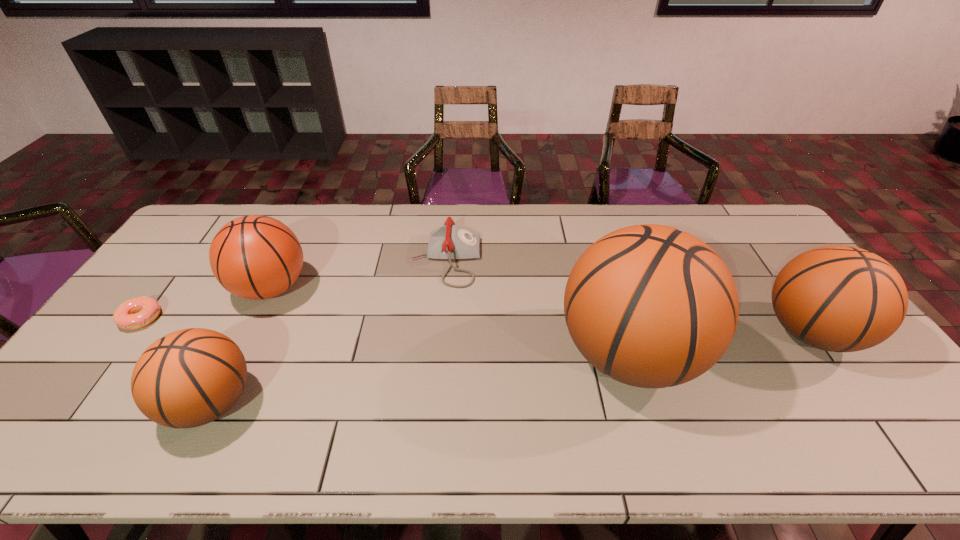
You are a GUI agent. You are given a task and a screenshot of the screen. Output one action in this format:
    pyautogui.click(x=<x>, y=<y>)
    Task: Click on the vacant space in between the doughnut and the rightmost object
    Image resolution: width=960 pixels, height=540 pixels.
    Given the screenshot: What is the action you would take?
    pyautogui.click(x=475, y=325)

The height and width of the screenshot is (540, 960). I want to click on object that stands as the closest to the tallest object, so [x=836, y=298].

Locate an element on the screen. object that is the fourth nearest to the rightmost basketball is located at coordinates (188, 378).

Identify which basketball is located as the fourth nearest to the shortest object. Please provide its 2D coordinates. Your answer should be formatted as a tuple, i.e. [(x, y)], where the tuple contains the x and y coordinates of a point satisfying the conditions above.

[(836, 298)]

Where is `basketball that is the fourth closest to the shortest object`? This screenshot has height=540, width=960. basketball that is the fourth closest to the shortest object is located at coordinates pyautogui.click(x=836, y=298).

The image size is (960, 540). Find the location of `free location that satisfies the following two spatial constraints: 1. on the front side of the tallest basketball; 2. on the right side of the leftmost object`. free location that satisfies the following two spatial constraints: 1. on the front side of the tallest basketball; 2. on the right side of the leftmost object is located at coordinates (115, 353).